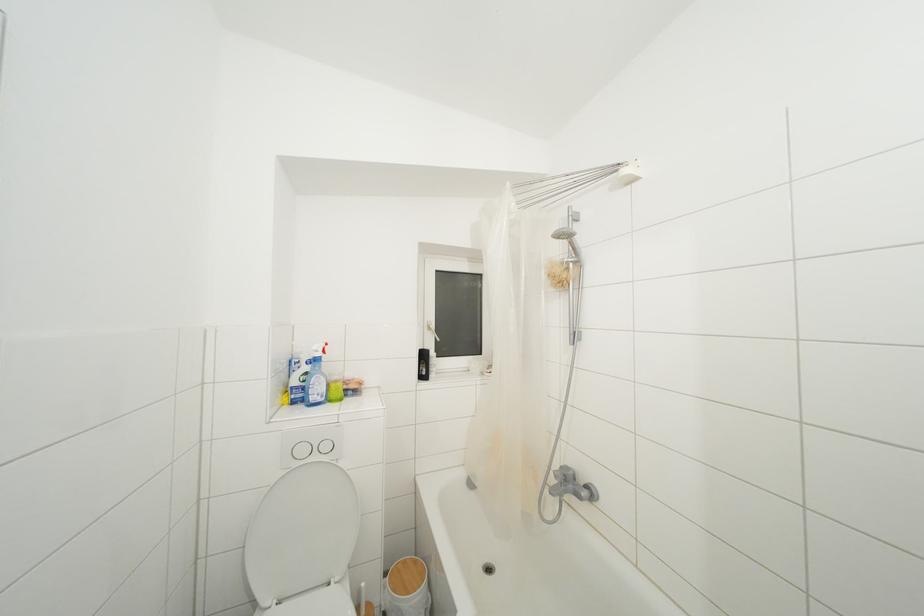
What are the coordinates of `white toilet lid` in the screenshot? It's located at (304, 543).